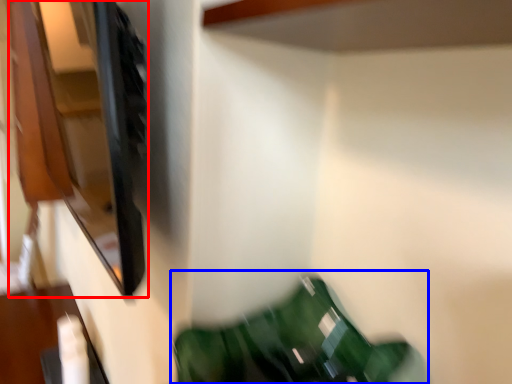
Question: Among these objects, which one is nearest to the camera, cabinet (highlighted by a red box) or bean bag chair (highlighted by a blue box)?

Choices:
 (A) cabinet
 (B) bean bag chair

Answer: (B)